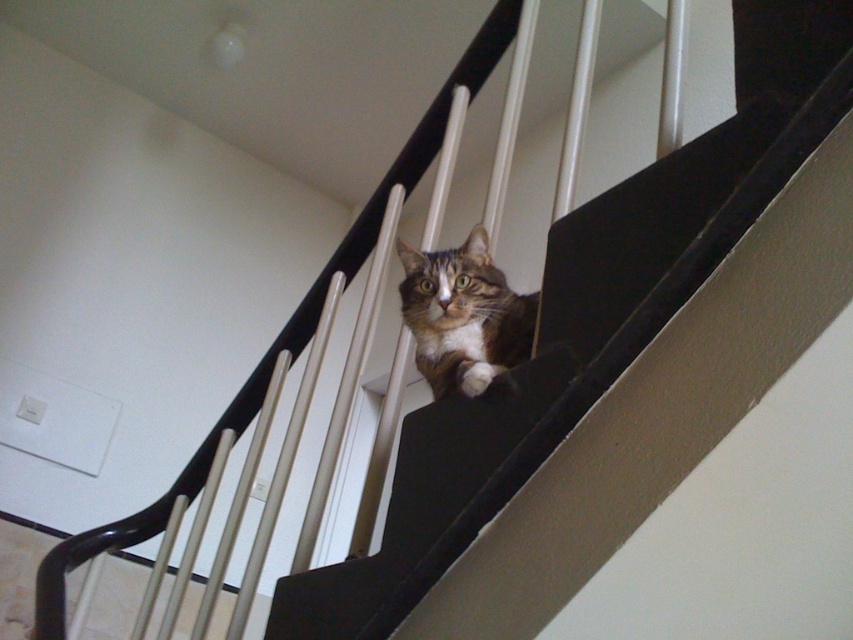
You are a visitor in this house and want to pet the cat. The brown furry cat at center and the brown fur cat at center are both present. Which one should you approach if you prefer a bigger cat?

You should approach the brown furry cat at center because it has a larger size compared to the brown fur cat at center.

You are a visitor entering the house and see the brown furry cat at center and the brown fur cat at center. Which one is closer to the floor?

The brown furry cat at center is closer to the floor since it is positioned below the brown fur cat at center.

You are a photographer trying to capture a picture of the brown furry cat at center and the brown fur cat at center. You notice that one of them is wider than the other. Which cat has a greater width?

The brown furry cat at center has a greater width than the brown fur cat at center according to the description.